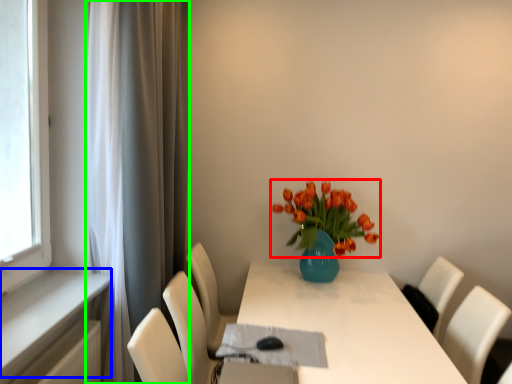
Question: Which is nearer to the flower (highlighted by a red box)? window sill (highlighted by a blue box) or curtain (highlighted by a green box).

Choices:
 (A) window sill
 (B) curtain

Answer: (B)